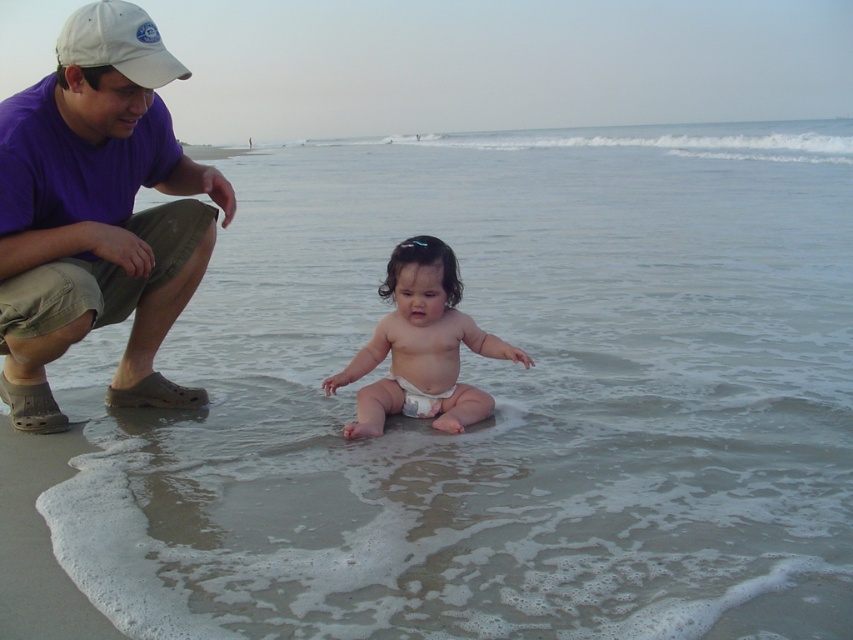
Question: Does white fabric cap at upper left lie in front of white cloth diaper at center?

Choices:
 (A) no
 (B) yes

Answer: (B)

Question: Can you confirm if white fabric cap at upper left is thinner than white cloth diaper at center?

Choices:
 (A) no
 (B) yes

Answer: (A)

Question: Which of the following is the farthest from the observer?

Choices:
 (A) white cloth diaper at center
 (B) white diaper toddler at center

Answer: (A)

Question: Which of these objects is positioned closest to the purple cotton shirt at upper left?

Choices:
 (A) white cloth diaper at center
 (B) white fabric cap at upper left

Answer: (B)

Question: Can you confirm if white diaper toddler at center is positioned to the left of white cloth diaper at center?

Choices:
 (A) yes
 (B) no

Answer: (B)

Question: Which point is closer to the camera?

Choices:
 (A) (433, 394)
 (B) (376, 326)

Answer: (A)